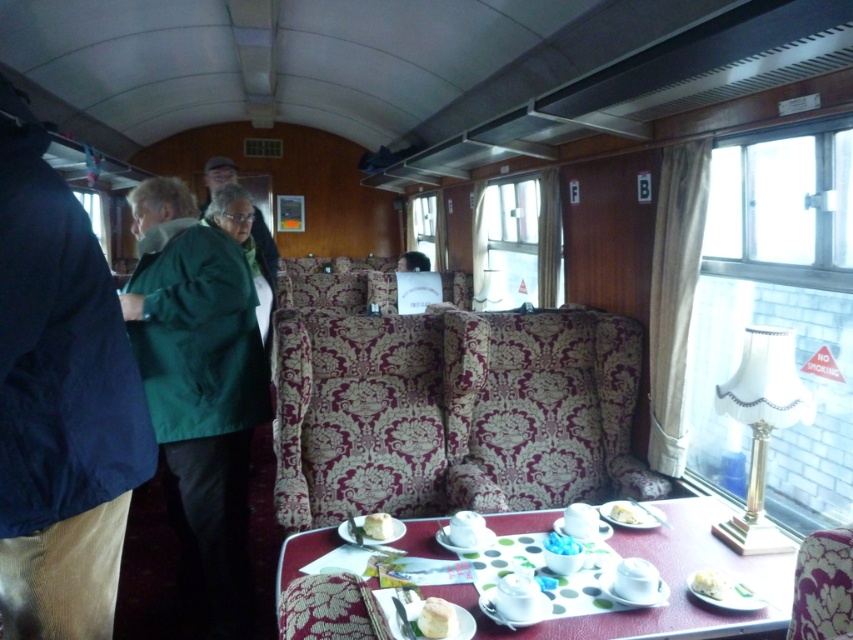
You are a passenger on this vintage train carriage and you want to place your dark blue fabric coat somewhere. You see the point at coordinates (59,401). Is there space to place your coat there?

Yes, the dark blue fabric coat at left is located at point (59,401), so there is space to place your coat there.

You are a passenger sitting at the table in the vintage train carriage. You want to grab a bite without moving your hands too far from your current position. Which cake, the white creamy cake at lower right or the smooth cream cake at table center, is easier to reach?

The white creamy cake at lower right is closer to the viewer than the smooth cream cake at table center, so it is easier to reach without moving your hands too far.

You are a passenger in the vintage train carriage and want to place a small item on the table between the two points, point (717, 582) and point (631, 504). Which point should you choose to place the item so it is closer to you?

You should place the item at point (717, 582) because it is closer to the viewer than point (631, 504).